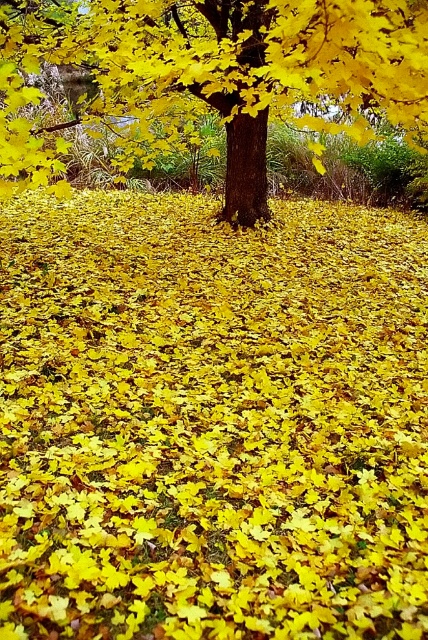
Question: Among these points, which one is farthest from the camera?

Choices:
 (A) (416, 108)
 (B) (421, 234)

Answer: (B)

Question: Is yellow matte leaves at center in front of shiny brown tree trunk at center?

Choices:
 (A) yes
 (B) no

Answer: (B)

Question: Can you confirm if yellow matte leaves at center is thinner than shiny brown tree trunk at center?

Choices:
 (A) yes
 (B) no

Answer: (B)

Question: Which point is farther from the camera taking this photo?

Choices:
 (A) (89, 44)
 (B) (127, 228)

Answer: (B)

Question: Which point is farther to the camera?

Choices:
 (A) shiny brown tree trunk at center
 (B) yellow matte leaves at center

Answer: (B)

Question: Does yellow matte leaves at center have a larger size compared to shiny brown tree trunk at center?

Choices:
 (A) no
 (B) yes

Answer: (B)